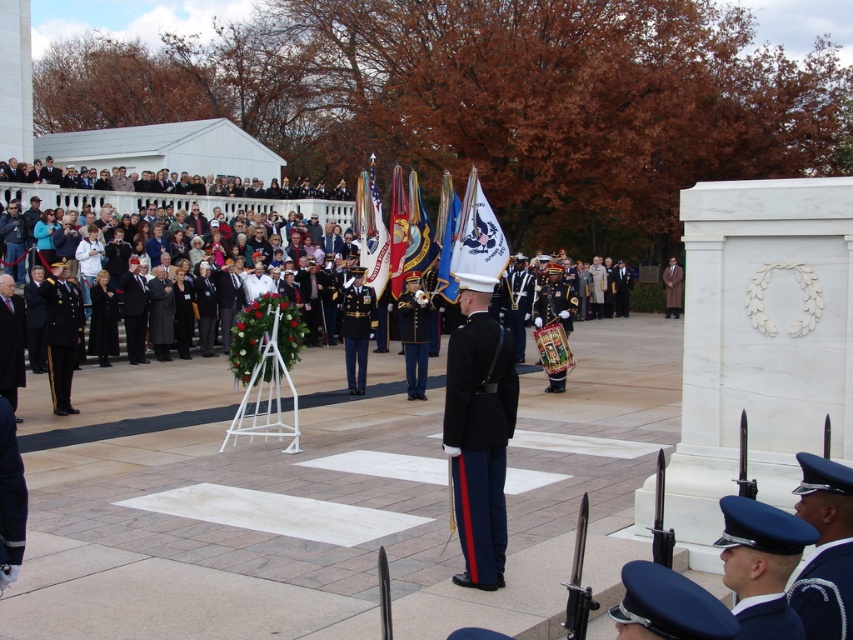
Consider the image. You are a photographer at the ceremony and need to capture both the shiny gold uniform at center and the shiny dark blue uniform at center in a single frame. Based on their positions, which uniform should you focus on first to ensure both are in the shot?

The shiny gold uniform at center is to the right of the shiny dark blue uniform at center, so focusing on the shiny dark blue uniform at center first would allow you to frame both uniforms since it is positioned to the left of the shiny gold one.

You are a photographer positioned at the center of the scene. You want to capture a closeup shot of the blue uniform at lower right. Which direction should you move to get closer to it?

The blue uniform at lower right is located at point 0.893 on the horizontal axis. Since you are at the center, you should move to the right to get closer to the blue uniform at lower right.

Looking at this image, you are a photographer at the ceremony and need to capture a clear photo of both the shiny gold uniform at center and the shiny dark blue uniform at center. Which uniform should you focus on first to ensure both are in focus?

You should focus on the shiny dark blue uniform at center first because it is positioned above the shiny gold uniform at center, so adjusting focus starting from the higher object will help ensure both are in focus.